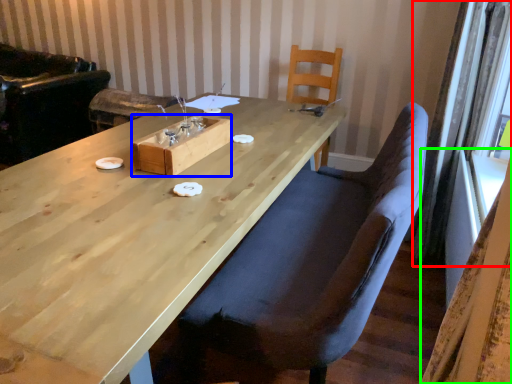
Question: Estimate the real-world distances between objects in this image. Which object is closer to curtain (highlighted by a red box), wood (highlighted by a blue box) or curtain (highlighted by a green box)?

Choices:
 (A) wood
 (B) curtain

Answer: (A)